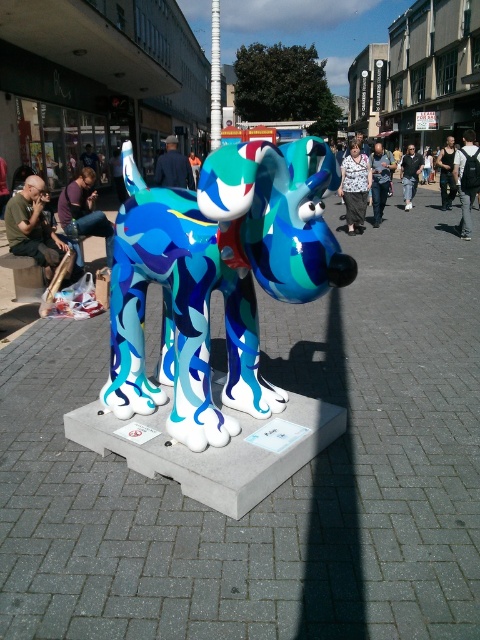
Question: Does black backpack at center come in front of black cotton t-shirt at center?

Choices:
 (A) yes
 (B) no

Answer: (A)

Question: Is smooth concrete base at center to the right of white plastic pole at center from the viewer's perspective?

Choices:
 (A) no
 (B) yes

Answer: (B)

Question: Estimate the real-world distances between objects in this image. Which object is closer to the white textured shirt at center?

Choices:
 (A) denim jeans at left
 (B) blue fabric jacket at center
 (C) shiny metallic dog at center

Answer: (B)

Question: Is the position of denim jeans at left more distant than that of white dotted blouse at center?

Choices:
 (A) no
 (B) yes

Answer: (A)

Question: Which is farther from the black backpack at center?

Choices:
 (A) black cotton shirt at center
 (B) denim jeans at left
 (C) white dotted blouse at center
 (D) green matte shirt at left

Answer: (D)

Question: Which point is closer to the camera?

Choices:
 (A) (453, 168)
 (B) (27, 394)
 (C) (474, 164)

Answer: (B)